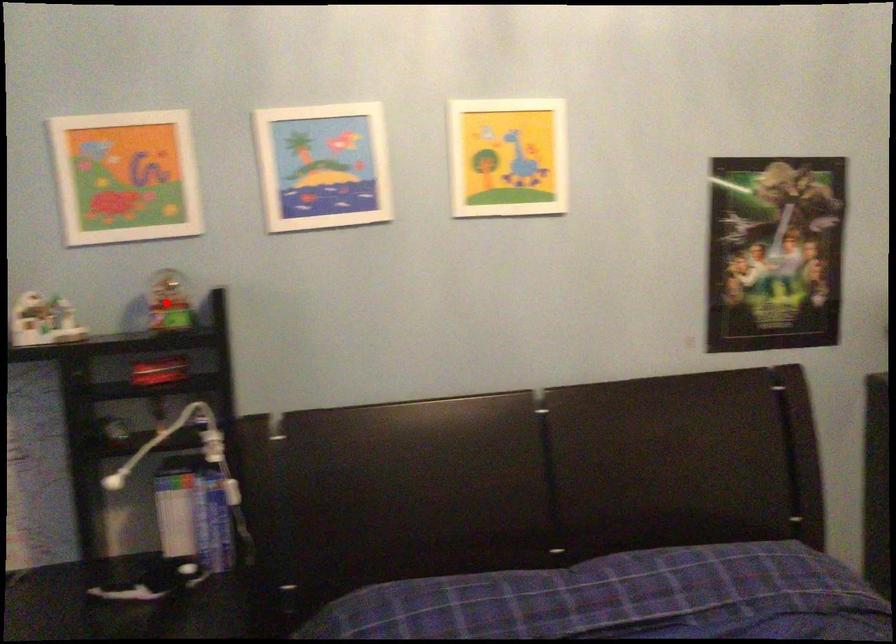
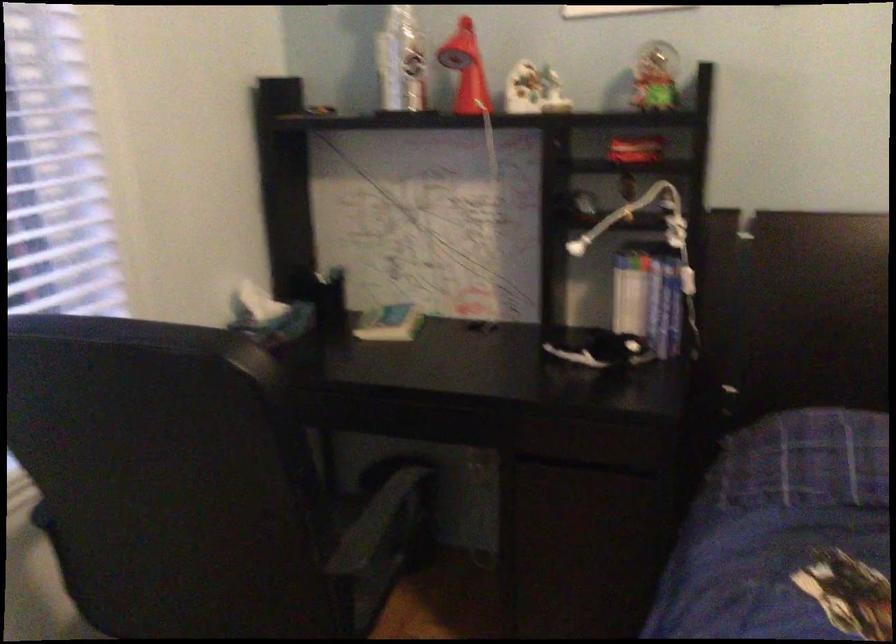
Find the pixel in the second image that matches the highlighted location in the first image.

(655, 77)